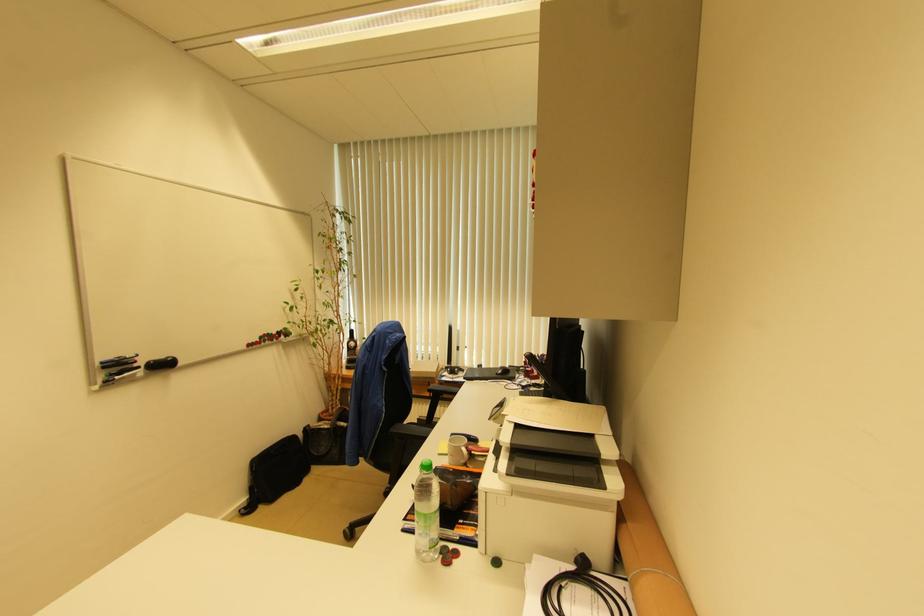
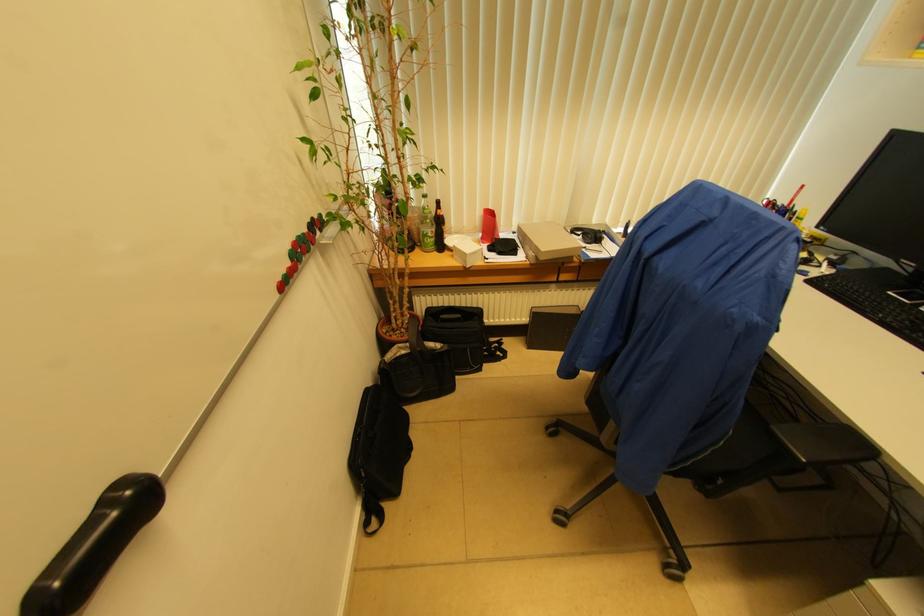
Find the pixel in the second image that matches pixel 150 365 in the first image.

(35, 600)